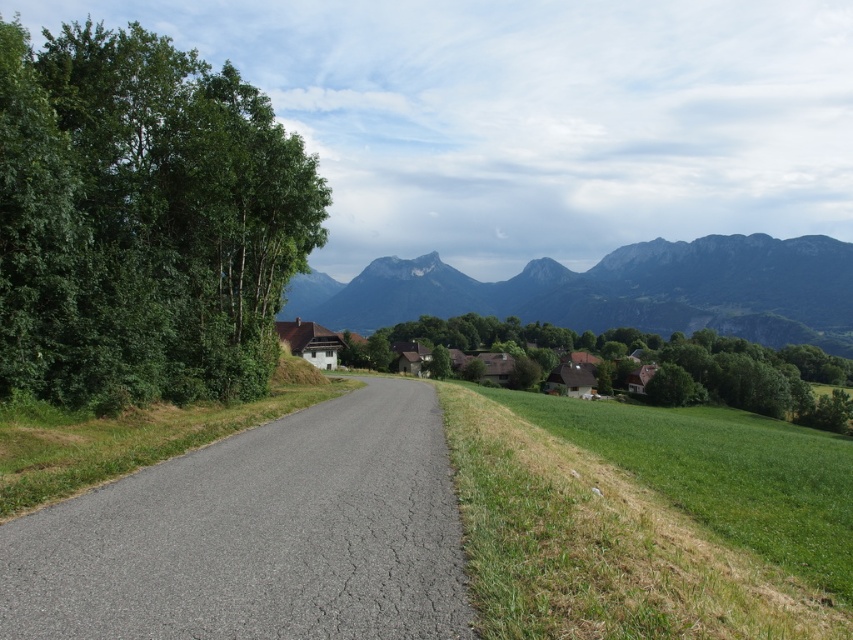
You are a hiker who has just arrived at the green leafy tree at left. You want to reach the white wooden houses at center. Given that your average walking pace is 3 miles per hour, how long will it take you to walk directly to the houses?

The green leafy tree at left is 571.94 feet away from white wooden houses at center. Converting feet to miles, 571.94 feet is approximately 0.108 miles. At a walking pace of 3 mph, the time taken would be distance divided by speed, so 0.108 miles divided by 3 mph equals approximately 0.036 hours. Converting hours to minutes by multiplying by 60 gives roughly 2.16 minutes. Therefore, it will take about 2 minutes to walk to the white wooden houses at center.

You are a hiker standing at point (142,220). You want to reach the village in the background. Which direction should you walk to get there?

The green leafy tree at left is located at point (142,220). Since the village is in the background, you should walk away from the green leafy tree at left towards the direction where the village is situated.